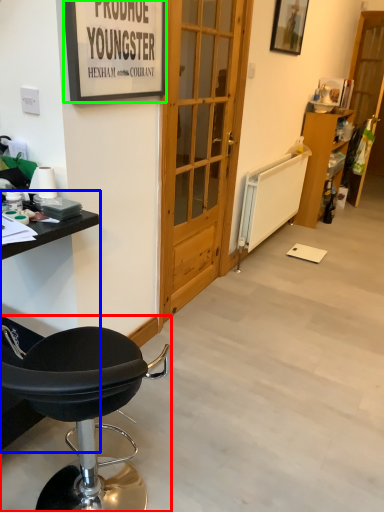
Question: Based on their relative distances, which object is nearer to chair (highlighted by a red box)? Choose from table (highlighted by a blue box) and picture frame (highlighted by a green box).

Choices:
 (A) table
 (B) picture frame

Answer: (A)